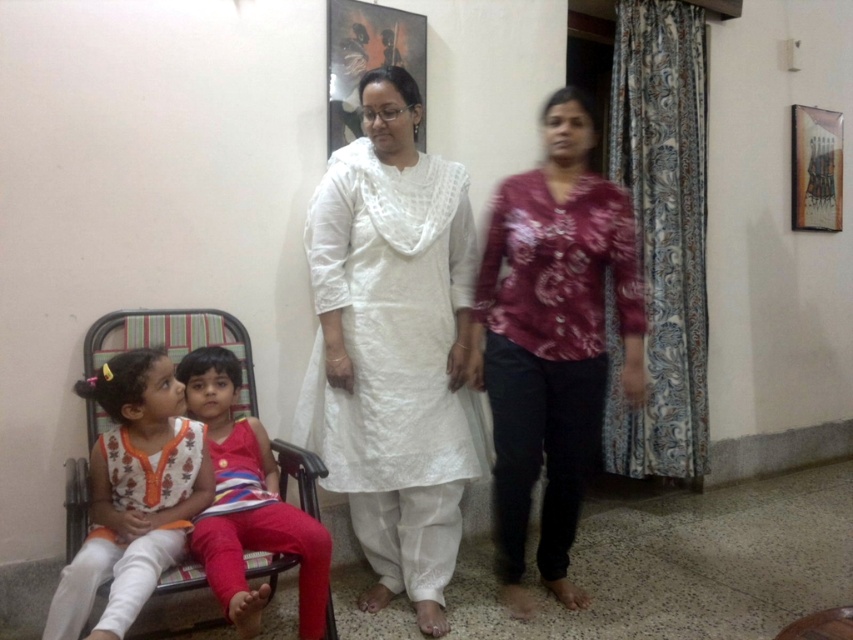
Is white cotton kurta at center taller than matte floral blouse at center?

Yes, white cotton kurta at center is taller than matte floral blouse at center.

Is white cotton kurta at center positioned in front of matte floral blouse at center?

No.

Find the location of a particular element. white cotton kurta at center is located at coordinates (392, 346).

Consider the image. Is the position of matte floral blouse at center less distant than that of metallic fabric armchair at lower left?

No, matte floral blouse at center is further to the viewer.

The image size is (853, 640). Describe the element at coordinates (550, 340) in the screenshot. I see `matte floral blouse at center` at that location.

Is point (473, 349) farther from camera compared to point (282, 445)?

Yes.

I want to click on matte floral blouse at center, so click(x=550, y=340).

Is white cotton kurta at center thinner than metallic fabric armchair at lower left?

Yes.

Who is shorter, white cotton kurta at center or metallic fabric armchair at lower left?

metallic fabric armchair at lower left is shorter.

Which is in front, point (364, 211) or point (277, 566)?

Point (277, 566) is in front.

Identify the location of white cotton kurta at center. Image resolution: width=853 pixels, height=640 pixels. (392, 346).